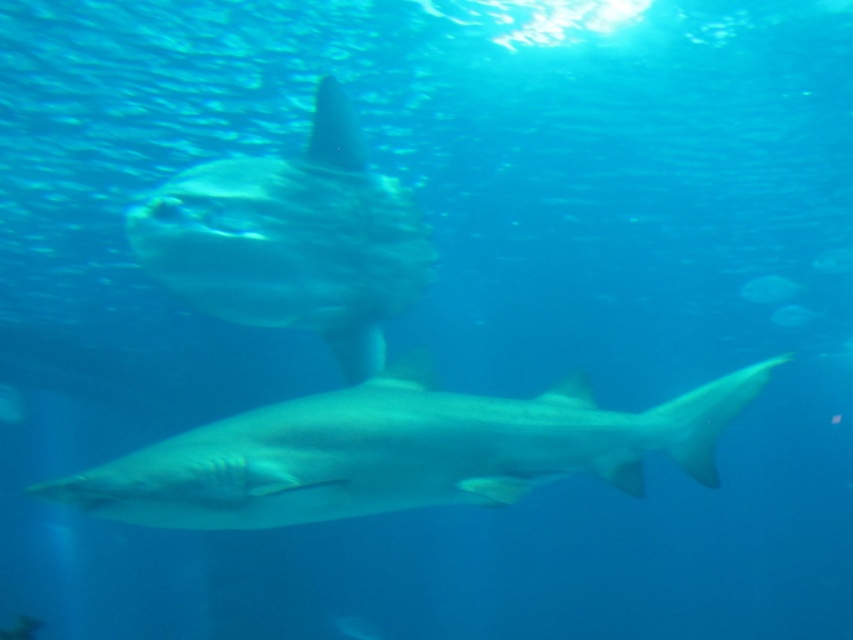
Between smooth gray shark at center and translucent white fish at center, which one has less height?

Standing shorter between the two is translucent white fish at center.

Is the position of smooth gray shark at center more distant than that of translucent white fish at center?

No.

Between point (526, 440) and point (795, 324), which one is positioned behind?

The point (795, 324) is behind.

Find the location of a particular element. smooth gray shark at center is located at coordinates (399, 452).

Between smooth gray shark at center and translucent white shark at center, which one has more height?

smooth gray shark at center

Which is below, smooth gray shark at center or translucent white shark at center?

Positioned lower is smooth gray shark at center.

Is point (688, 429) farther from viewer compared to point (775, 284)?

No, it is in front of (775, 284).

Locate an element on the screen. smooth gray shark at center is located at coordinates (399, 452).

Does translucent white shark at center appear over translucent white fish at center?

Correct, translucent white shark at center is located above translucent white fish at center.

Describe the element at coordinates (769, 289) in the screenshot. The height and width of the screenshot is (640, 853). I see `translucent white shark at center` at that location.

You are a GUI agent. You are given a task and a screenshot of the screen. Output one action in this format:
    pyautogui.click(x=<x>, y=<y>)
    Task: Click on the translucent white shark at center
    
    Given the screenshot: What is the action you would take?
    pyautogui.click(x=769, y=289)